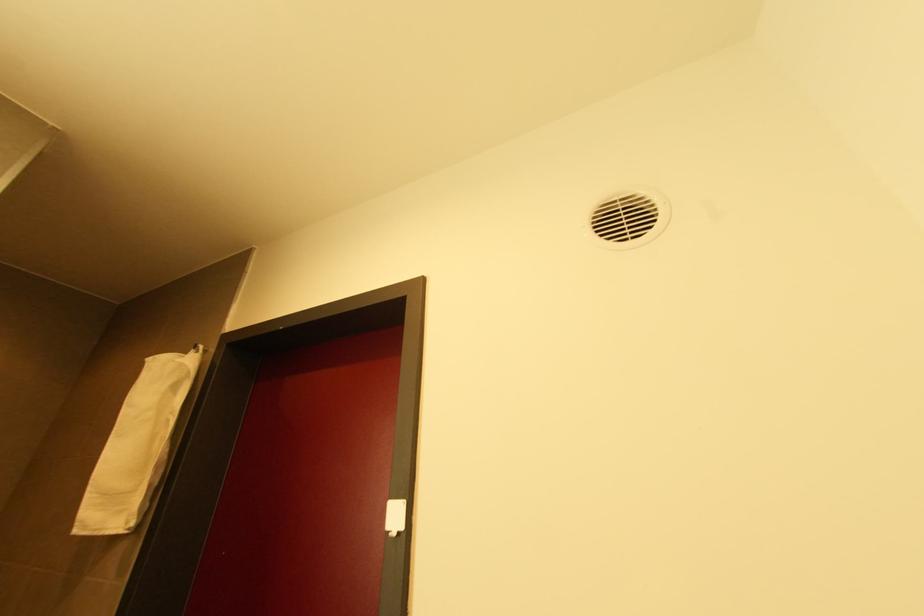
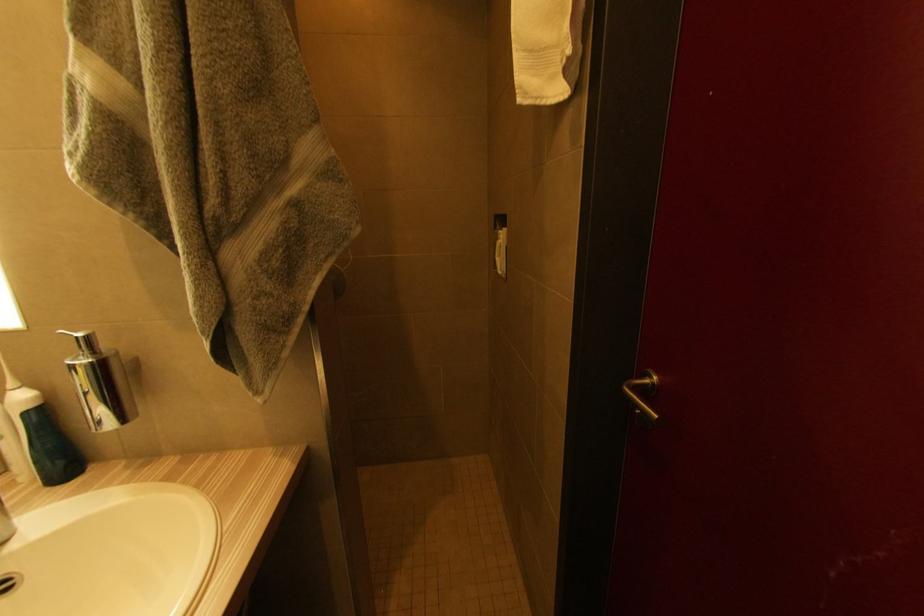
In the scene shown: How did the camera likely rotate?

The camera rotated toward left-down.